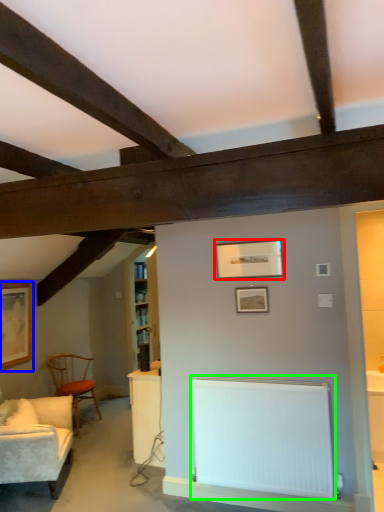
Question: Which object is positioned farthest from picture frame (highlighted by a red box)? Select from picture frame (highlighted by a blue box) and radiator (highlighted by a green box).

Choices:
 (A) picture frame
 (B) radiator

Answer: (A)